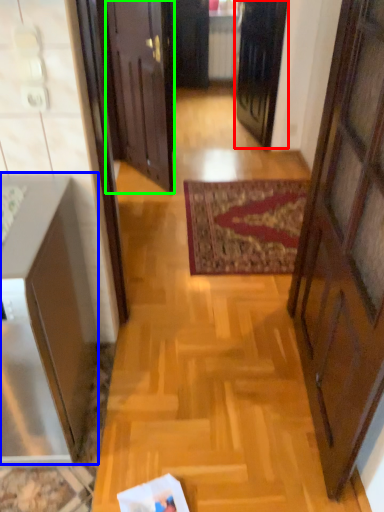
Question: Considering the real-world distances, which object is farthest from door (highlighted by a red box)? cabinetry (highlighted by a blue box) or door (highlighted by a green box)?

Choices:
 (A) cabinetry
 (B) door

Answer: (A)